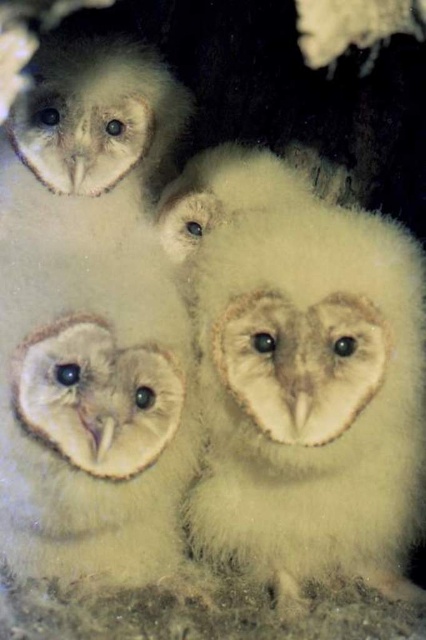
Is soft white fur owl at center wider than soft white feathers at upper center?

Yes.

Is point (339, 540) farther from viewer compared to point (83, 148)?

No, it is not.

In the scene shown: Who is more forward, (249, 493) or (103, 65)?

Point (249, 493)

Identify the location of soft white fur owl at center. (311, 396).